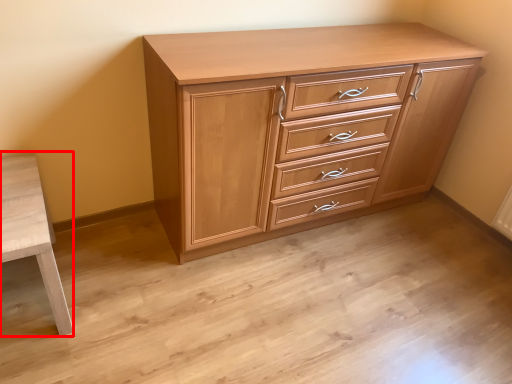
Question: From the image's perspective, what is the correct spatial positioning of table (annotated by the red box) in reference to chest of drawers?

Choices:
 (A) below
 (B) above

Answer: (A)